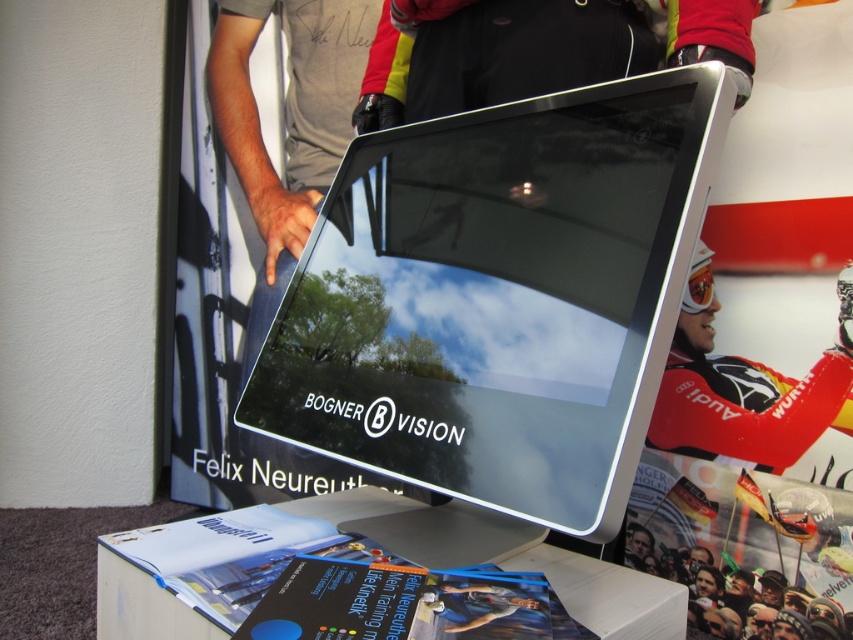
You are a visitor at an exhibition and want to place a souvenir on the white plastic table at lower center. However, the souvenir is as wide as the red matte skier at center. Will it fit on the table?

The white plastic table at lower center is wider than the red matte skier at center, so the souvenir will fit on the table since its width matches the skier, and the table is wider.

From the picture: You are a person who needs to place a 12 inch ruler on the white plastic table at lower center. Can you place it diagonally across the table without it hanging off the edges?

The distance between the objects is 28.93 inches, so the ruler can be placed diagonally as the table is large enough to accommodate it without hanging off.

You are a delivery person who needs to place a box that is 11 inches tall on the white plastic table at lower center. Can the box be placed on the table without touching the sleek silver monitor at center?

The distance between the sleek silver monitor at center and the white plastic table at lower center is 10.59 inches. Since the box is 11 inches tall, placing it on the table would cause it to touch or exceed the space available, so it cannot be placed safely without touching the monitor.